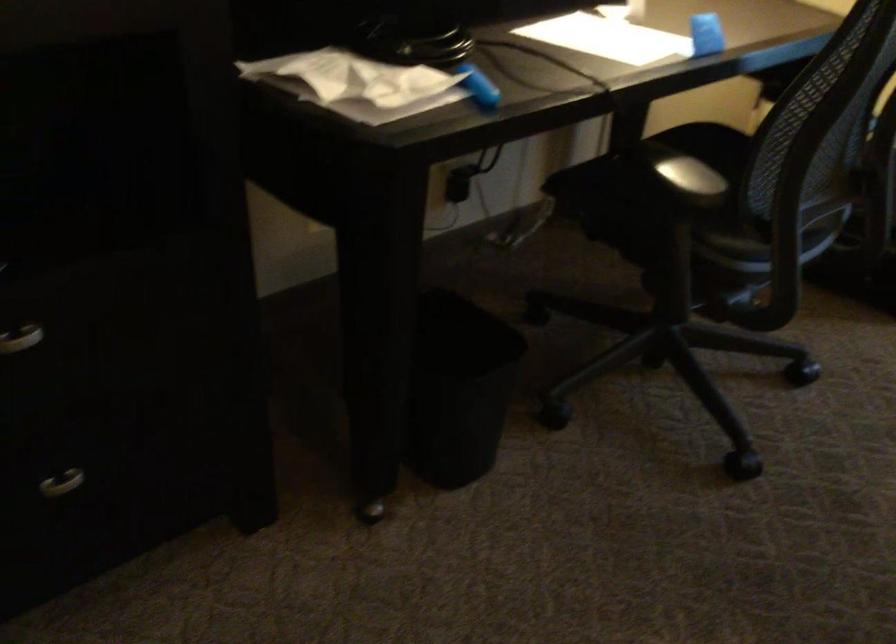
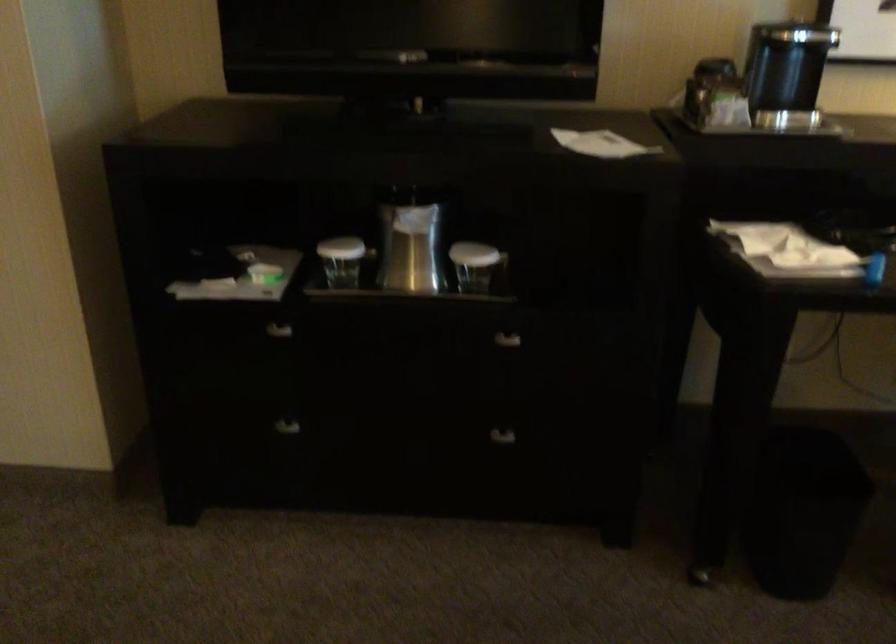
Question: The camera is either moving clockwise (left) or counter-clockwise (right) around the object. The first image is from the beginning of the video and the second image is from the end. Is the camera moving left or right when shooting the video?

Choices:
 (A) Left
 (B) Right

Answer: (B)